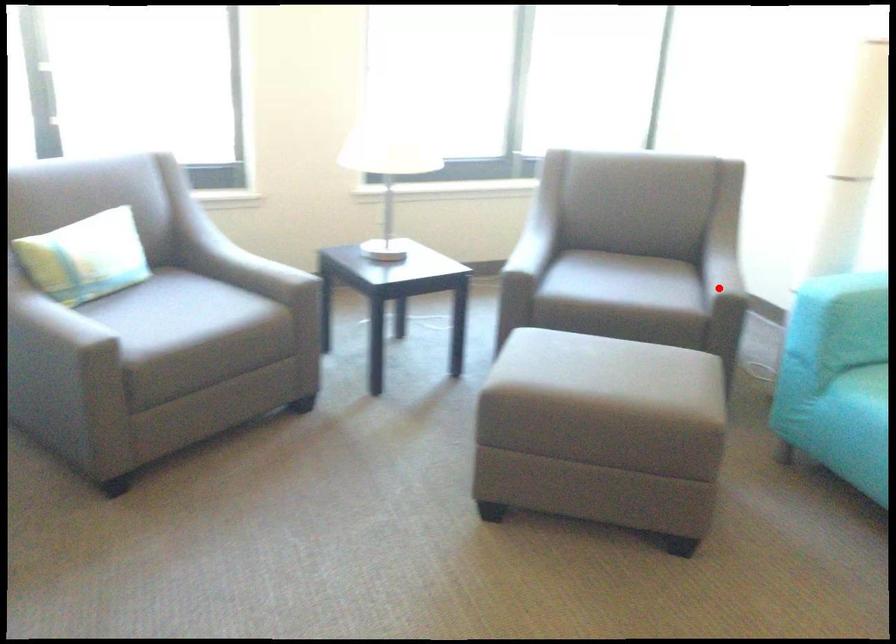
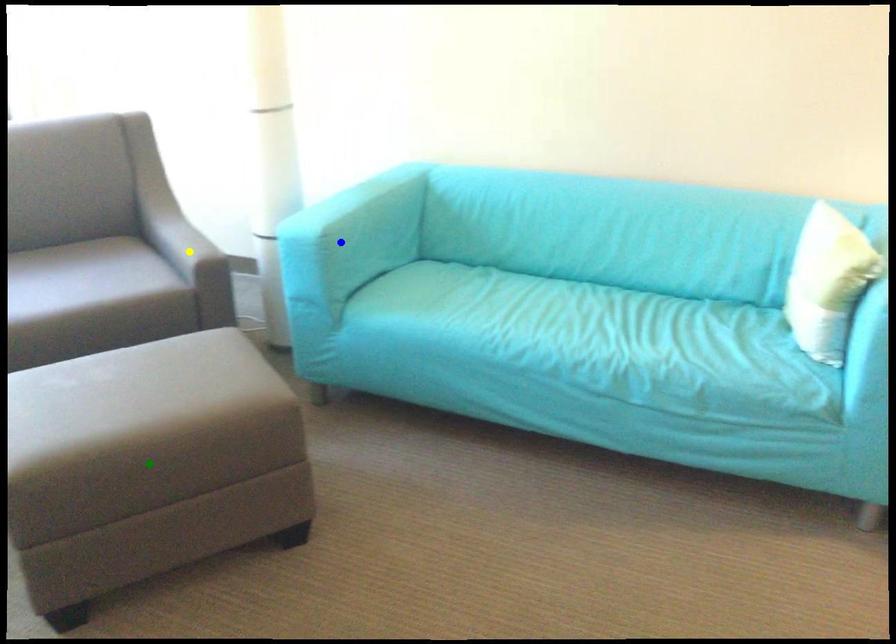
Question: I am providing you with two images of the same scene from different viewpoints. A red point is marked on the first image. You are given multiple points on the second image. Can you choose the point in image 2 that corresponds to the point in image 1?

Choices:
 (A) yellow point
 (B) green point
 (C) blue point

Answer: (A)